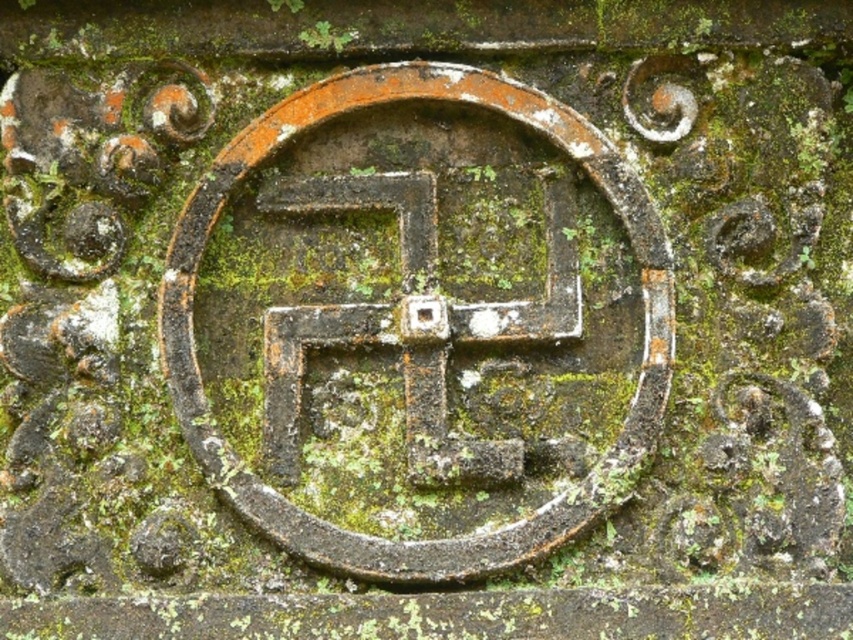
Is the position of rusty metal swastika at center less distant than that of rusty metal cross at center?

Yes, it is.

Does rusty metal swastika at center lie behind rusty metal cross at center?

That is False.

Where is `rusty metal swastika at center`? The height and width of the screenshot is (640, 853). rusty metal swastika at center is located at coordinates (426, 540).